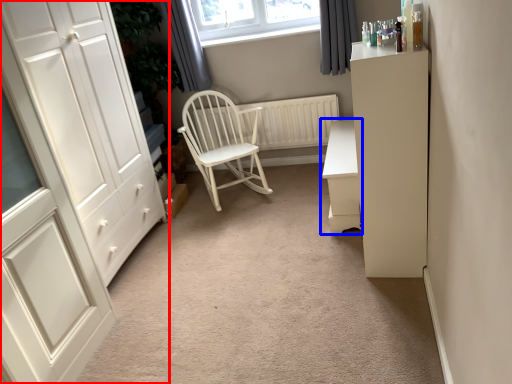
Question: Which of the following is the closest to the observer, cupboard (highlighted by a red box) or chest of drawers (highlighted by a blue box)?

Choices:
 (A) cupboard
 (B) chest of drawers

Answer: (A)